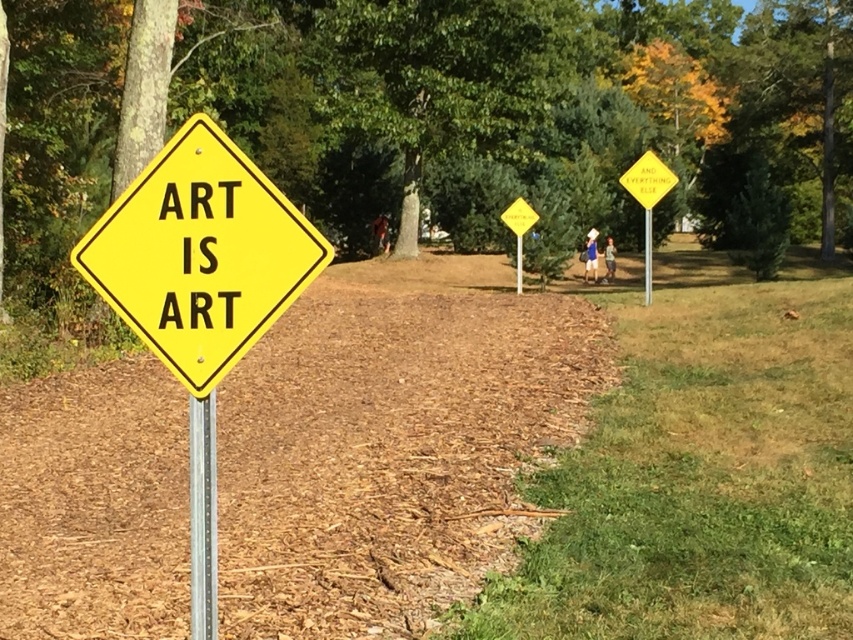
You are standing at the main yellow sign in the park and want to take a photo of both the point at coordinates point (x=213, y=605) and the point at coordinates point (x=646, y=300). Which point will appear larger in your photo?

Point (x=213, y=605) will appear larger in the photo because it is closer to the camera than point (x=646, y=300).

You are a city planner assessing the park layout. You notice two poles at the center of the scene. Which pole is thinner? The metallic silver pole at center or the yellow metal pole at center?

The metallic silver pole at center has a lesser width compared to the yellow metal pole at center, so the metallic silver pole at center is thinner.